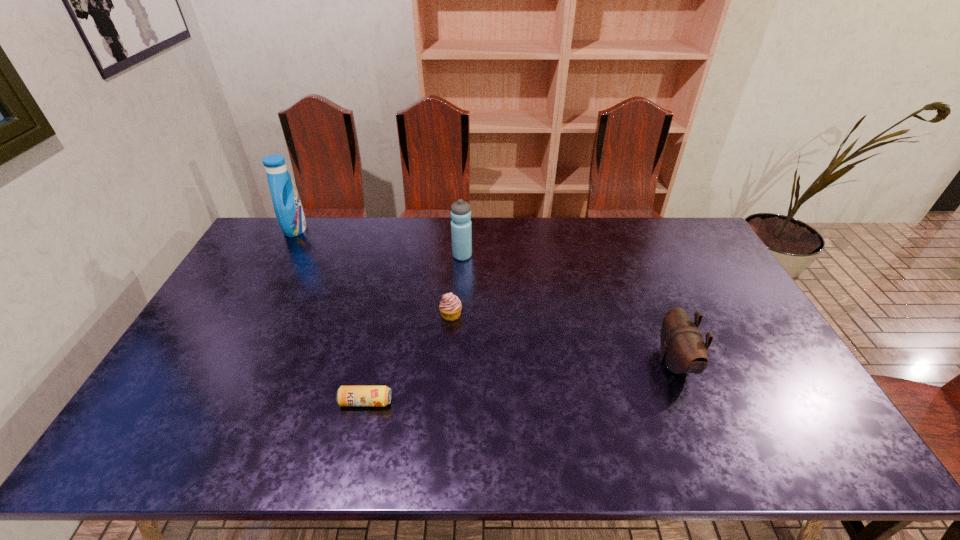
The height and width of the screenshot is (540, 960). In order to click on free space located 0.350m on the front-facing side of the tallest object in this screenshot , I will do click(x=397, y=229).

What are the coordinates of `free point located 0.140m on the front of the second farthest object` in the screenshot? It's located at (461, 289).

The image size is (960, 540). Identify the location of free region located with the flap open on the third tallest object. [537, 362].

Where is `vacant space located 0.160m with the flap open on the third tallest object`? This screenshot has height=540, width=960. vacant space located 0.160m with the flap open on the third tallest object is located at coordinates (599, 362).

Identify the location of blank space located 0.210m with the flap open on the third tallest object. This screenshot has width=960, height=540. point(581,362).

Locate an element on the screen. The image size is (960, 540). vacant space located on the right of the cupcake is located at coordinates (509, 315).

The width and height of the screenshot is (960, 540). In order to click on vacant space located 0.090m on the right of the shortest object in this screenshot , I will do `click(427, 402)`.

The image size is (960, 540). I want to click on detergent that is at the far edge, so click(x=287, y=205).

Identify the location of water bottle located in the far edge section of the desktop. The width and height of the screenshot is (960, 540). click(x=461, y=226).

The image size is (960, 540). Identify the location of object that is at the left edge. (287, 205).